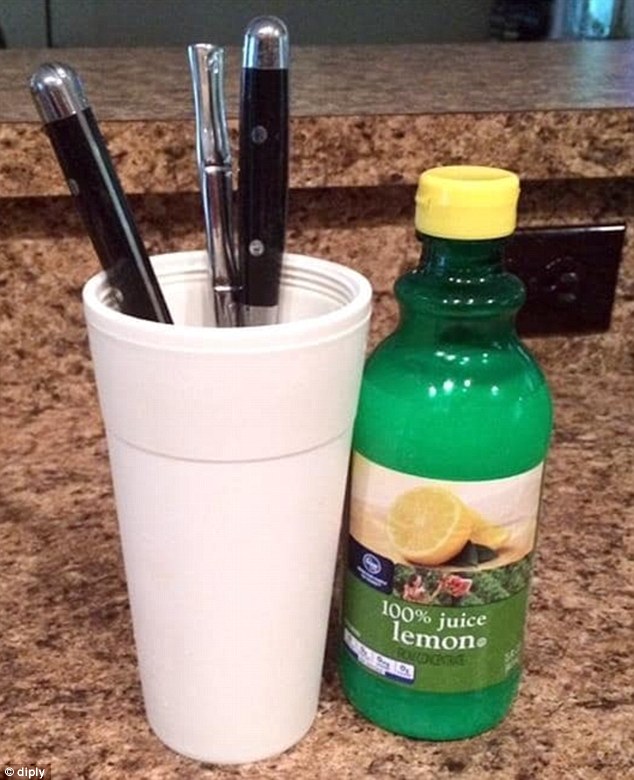
Where is `black outlet housing`? black outlet housing is located at coordinates (607, 278).